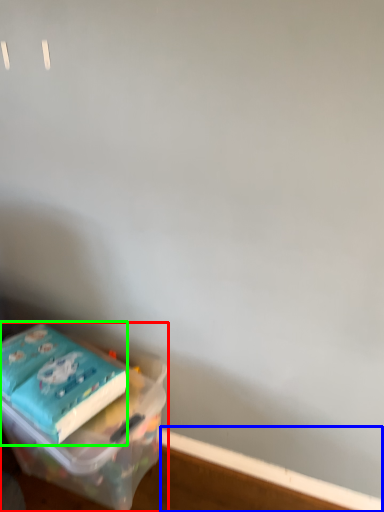
Question: Which object is the closest to the box (highlighted by a red box)? Choose among these: window sill (highlighted by a blue box) or paperback book (highlighted by a green box).

Choices:
 (A) window sill
 (B) paperback book

Answer: (B)